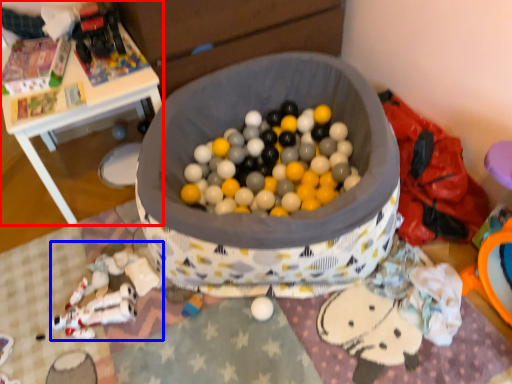
Question: Which point is closer to the camera, table (highlighted by a red box) or toy (highlighted by a blue box)?

Choices:
 (A) table
 (B) toy

Answer: (B)